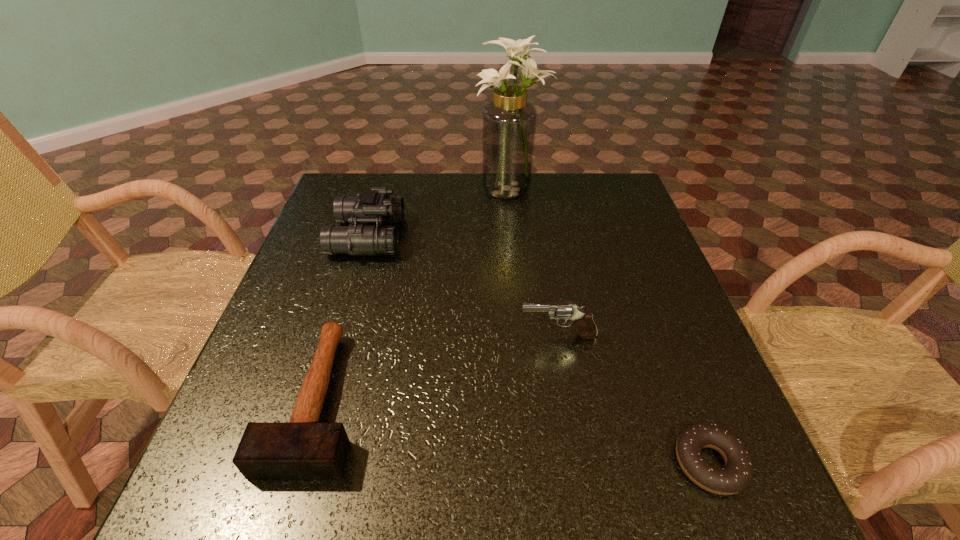
This screenshot has width=960, height=540. What are the coordinates of `free space between the fourth tallest object and the doughnut` in the screenshot? It's located at (514, 430).

You are a GUI agent. You are given a task and a screenshot of the screen. Output one action in this format:
    pyautogui.click(x=<x>, y=<y>)
    Task: Click on the empty location between the farthest object and the second farthest object
    The width and height of the screenshot is (960, 540).
    Given the screenshot: What is the action you would take?
    pyautogui.click(x=440, y=212)

Image resolution: width=960 pixels, height=540 pixels. In order to click on unoccupied area between the pistol and the mallet in this screenshot , I will do `click(439, 367)`.

Find the location of a particular element. This screenshot has width=960, height=540. free point between the binoculars and the third shortest object is located at coordinates (463, 286).

Locate an element on the screen. The image size is (960, 540). free space between the fourth tallest object and the third shortest object is located at coordinates (439, 367).

Locate an element on the screen. This screenshot has width=960, height=540. free space between the tallest object and the doughnut is located at coordinates (610, 326).

Where is `vacant area between the mallet and the second tallest object`? vacant area between the mallet and the second tallest object is located at coordinates (343, 317).

Locate an element on the screen. free spot between the fourth shortest object and the tallest object is located at coordinates (440, 212).

Locate an element on the screen. free space between the doughnut and the mallet is located at coordinates (514, 430).

Where is `vacant area that lies between the fourth nearest object and the mallet`? This screenshot has height=540, width=960. vacant area that lies between the fourth nearest object and the mallet is located at coordinates (343, 317).